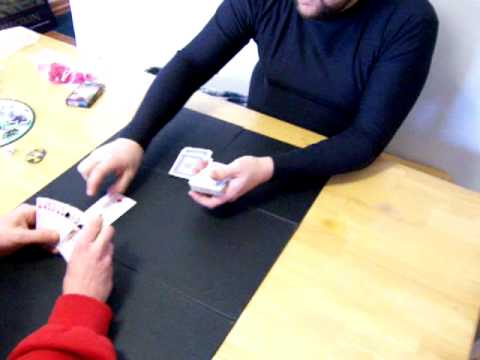
What are the coordinates of `yellowish knot on table` in the screenshot? It's located at (329, 224).